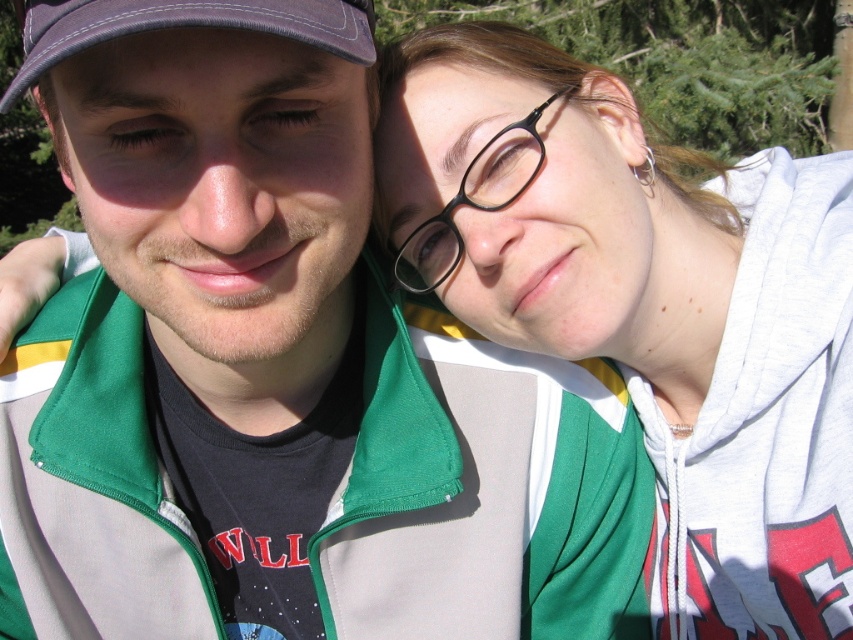
Question: Can you confirm if purple fabric baseball cap at upper left is positioned above black plastic glasses at upper right?

Choices:
 (A) no
 (B) yes

Answer: (B)

Question: Which object is closer to the camera taking this photo?

Choices:
 (A) purple fabric baseball cap at upper left
 (B) matte green hoodie at upper right

Answer: (A)

Question: Is matte green hoodie at upper right to the left of black plastic glasses at upper right from the viewer's perspective?

Choices:
 (A) yes
 (B) no

Answer: (B)

Question: Can you confirm if matte green hoodie at upper right is positioned to the left of black plastic glasses at upper right?

Choices:
 (A) yes
 (B) no

Answer: (B)

Question: Which point is closer to the camera?

Choices:
 (A) pyautogui.click(x=262, y=19)
 (B) pyautogui.click(x=637, y=224)
 (C) pyautogui.click(x=512, y=129)

Answer: (A)

Question: Estimate the real-world distances between objects in this image. Which object is closer to the purple fabric baseball cap at upper left?

Choices:
 (A) matte green hoodie at upper right
 (B) black plastic glasses at upper right

Answer: (B)